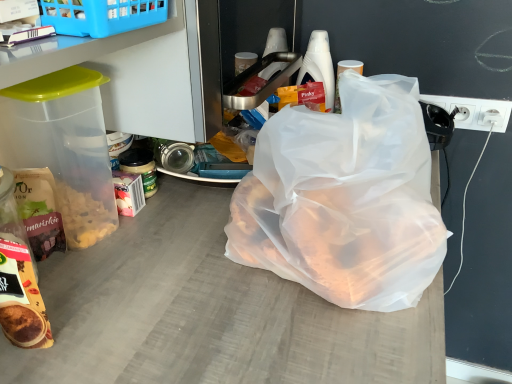
Question: Is matte brown snack bag at lower left bigger than matte brown bag of cereal at left?

Choices:
 (A) no
 (B) yes

Answer: (B)

Question: From a real-world perspective, is matte brown snack bag at lower left located beneath matte brown bag of cereal at left?

Choices:
 (A) no
 (B) yes

Answer: (B)

Question: Are matte brown snack bag at lower left and matte brown bag of cereal at left far apart?

Choices:
 (A) yes
 (B) no

Answer: (B)

Question: Is matte brown snack bag at lower left thinner than matte brown bag of cereal at left?

Choices:
 (A) no
 (B) yes

Answer: (A)

Question: Is the depth of matte brown snack bag at lower left greater than that of matte brown bag of cereal at left?

Choices:
 (A) no
 (B) yes

Answer: (A)

Question: Is transparent plastic bag at center situated inside white plastic socket at right or outside?

Choices:
 (A) outside
 (B) inside

Answer: (A)

Question: Considering the positions of transparent plastic bag at center and white plastic socket at right in the image, is transparent plastic bag at center taller or shorter than white plastic socket at right?

Choices:
 (A) tall
 (B) short

Answer: (A)

Question: Would you say transparent plastic bag at center is to the left or to the right of white plastic socket at right in the picture?

Choices:
 (A) left
 (B) right

Answer: (A)

Question: In terms of size, does transparent plastic bag at center appear bigger or smaller than white plastic socket at right?

Choices:
 (A) big
 (B) small

Answer: (A)

Question: In terms of height, does white plastic bottle at upper right look taller or shorter compared to matte brown snack bag at lower left?

Choices:
 (A) short
 (B) tall

Answer: (B)

Question: Is point (321, 41) closer or farther from the camera than point (7, 311)?

Choices:
 (A) closer
 (B) farther

Answer: (B)

Question: From the image's perspective, is white plastic bottle at upper right above or below matte brown snack bag at lower left?

Choices:
 (A) above
 (B) below

Answer: (A)

Question: Is white plastic bottle at upper right to the left or to the right of matte brown snack bag at lower left in the image?

Choices:
 (A) right
 (B) left

Answer: (A)

Question: Is point (295, 82) closer or farther from the camera than point (457, 107)?

Choices:
 (A) closer
 (B) farther

Answer: (B)

Question: In terms of width, does white plastic bottle at upper right look wider or thinner when compared to white plastic socket at right?

Choices:
 (A) thin
 (B) wide

Answer: (B)